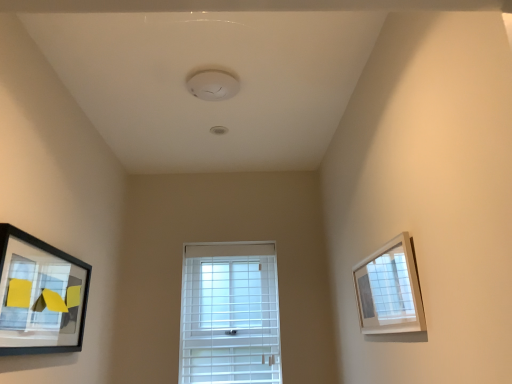
Measure the distance between white matte picture frame at upper right, which ranks as the 2th picture frame in left-to-right order, and camera.

1.04 meters.

Locate an element on the screen. matte black picture frame at left, which is counted as the 2th picture frame, starting from the right is located at coordinates (40, 296).

Locate an element on the screen. white matte picture frame at upper right, acting as the 1th picture frame starting from the right is located at coordinates (389, 290).

Can you confirm if white plastic window at center is wider than matte black picture frame at left, positioned as the 1th picture frame in left-to-right order?

Yes, white plastic window at center is wider than matte black picture frame at left, positioned as the 1th picture frame in left-to-right order.

Where is `window behind the matte black picture frame at left, which is counted as the 2th picture frame, starting from the right`? The height and width of the screenshot is (384, 512). window behind the matte black picture frame at left, which is counted as the 2th picture frame, starting from the right is located at coordinates (230, 314).

Considering the relative positions of white plastic window at center and matte black picture frame at left, which is counted as the 2th picture frame, starting from the right, in the image provided, is white plastic window at center to the right of matte black picture frame at left, which is counted as the 2th picture frame, starting from the right, from the viewer's perspective?

Yes, white plastic window at center is to the right of matte black picture frame at left, which is counted as the 2th picture frame, starting from the right.

From the image's perspective, is white plastic window at center on matte black picture frame at left, positioned as the 1th picture frame in left-to-right order?

Incorrect, from the image's perspective, white plastic window at center is lower than matte black picture frame at left, positioned as the 1th picture frame in left-to-right order.

Is white plastic window at center touching white matte picture frame at upper right, which ranks as the 2th picture frame in left-to-right order?

white plastic window at center is not next to white matte picture frame at upper right, which ranks as the 2th picture frame in left-to-right order, and they're not touching.

Can you confirm if white plastic window at center is positioned to the right of white matte picture frame at upper right, which ranks as the 2th picture frame in left-to-right order?

Incorrect, white plastic window at center is not on the right side of white matte picture frame at upper right, which ranks as the 2th picture frame in left-to-right order.

Looking at this image, from a real-world perspective, which is physically above, white plastic window at center or white matte picture frame at upper right, acting as the 1th picture frame starting from the right?

white matte picture frame at upper right, acting as the 1th picture frame starting from the right, is physically above.

Based on the photo, would you say white plastic window at center is outside white matte picture frame at upper right, acting as the 1th picture frame starting from the right?

white plastic window at center lies outside white matte picture frame at upper right, acting as the 1th picture frame starting from the right,'s area.

Which of these two, white matte picture frame at upper right, acting as the 1th picture frame starting from the right, or white plastic window at center, is smaller?

Smaller between the two is white matte picture frame at upper right, acting as the 1th picture frame starting from the right.

Between point (409, 254) and point (258, 340), which one is positioned behind?

The point (258, 340) is behind.

Which object is wider, white matte picture frame at upper right, acting as the 1th picture frame starting from the right, or white plastic window at center?

white plastic window at center is wider.

From the image's perspective, is white matte picture frame at upper right, which ranks as the 2th picture frame in left-to-right order, above or below white plastic window at center?

Clearly, from the image's perspective, white matte picture frame at upper right, which ranks as the 2th picture frame in left-to-right order, is above white plastic window at center.

Is white matte picture frame at upper right, acting as the 1th picture frame starting from the right, not near matte black picture frame at left, which is counted as the 2th picture frame, starting from the right?

Yes, white matte picture frame at upper right, acting as the 1th picture frame starting from the right, and matte black picture frame at left, which is counted as the 2th picture frame, starting from the right, are located far from each other.

From the image's perspective, is white matte picture frame at upper right, acting as the 1th picture frame starting from the right, under matte black picture frame at left, positioned as the 1th picture frame in left-to-right order?

No, from the image's perspective, white matte picture frame at upper right, acting as the 1th picture frame starting from the right, is not beneath matte black picture frame at left, positioned as the 1th picture frame in left-to-right order.

From a real-world perspective, is white matte picture frame at upper right, which ranks as the 2th picture frame in left-to-right order, located higher than matte black picture frame at left, which is counted as the 2th picture frame, starting from the right?

Incorrect, from a real-world perspective, white matte picture frame at upper right, which ranks as the 2th picture frame in left-to-right order, is lower than matte black picture frame at left, which is counted as the 2th picture frame, starting from the right.

Based on the photo, considering the relative sizes of white matte picture frame at upper right, acting as the 1th picture frame starting from the right, and matte black picture frame at left, positioned as the 1th picture frame in left-to-right order, in the image provided, is white matte picture frame at upper right, acting as the 1th picture frame starting from the right, smaller than matte black picture frame at left, positioned as the 1th picture frame in left-to-right order,?

Correct, white matte picture frame at upper right, acting as the 1th picture frame starting from the right, occupies less space than matte black picture frame at left, positioned as the 1th picture frame in left-to-right order.

Is matte black picture frame at left, which is counted as the 2th picture frame, starting from the right, at the right side of white matte picture frame at upper right, acting as the 1th picture frame starting from the right?

No, matte black picture frame at left, which is counted as the 2th picture frame, starting from the right, is not to the right of white matte picture frame at upper right, acting as the 1th picture frame starting from the right.

Who is more distant, matte black picture frame at left, positioned as the 1th picture frame in left-to-right order, or white matte picture frame at upper right, acting as the 1th picture frame starting from the right?

white matte picture frame at upper right, acting as the 1th picture frame starting from the right, is behind.

At what (x,y) coordinates should I click in order to perform the action: click on picture frame to the right of matte black picture frame at left, positioned as the 1th picture frame in left-to-right order. Please return your answer as a coordinate pair (x, y). The width and height of the screenshot is (512, 384). Looking at the image, I should click on (389, 290).

Is matte black picture frame at left, positioned as the 1th picture frame in left-to-right order, completely or partially outside of white matte picture frame at upper right, which ranks as the 2th picture frame in left-to-right order?

Indeed, matte black picture frame at left, positioned as the 1th picture frame in left-to-right order, is completely outside white matte picture frame at upper right, which ranks as the 2th picture frame in left-to-right order.

Between matte black picture frame at left, which is counted as the 2th picture frame, starting from the right, and white plastic window at center, which one has larger size?

With larger size is white plastic window at center.

Measure the distance from matte black picture frame at left, positioned as the 1th picture frame in left-to-right order, to white plastic window at center.

They are 1.03 meters apart.

From the image's perspective, is matte black picture frame at left, which is counted as the 2th picture frame, starting from the right, over white plastic window at center?

Correct, matte black picture frame at left, which is counted as the 2th picture frame, starting from the right, appears higher than white plastic window at center in the image.

Is matte black picture frame at left, which is counted as the 2th picture frame, starting from the right, in front of or behind white plastic window at center in the image?

matte black picture frame at left, which is counted as the 2th picture frame, starting from the right, is in front of white plastic window at center.

The image size is (512, 384). Find the location of `picture frame on the left side of white plastic window at center`. picture frame on the left side of white plastic window at center is located at coordinates (40, 296).

In the image, there is a white matte picture frame at upper right, acting as the 1th picture frame starting from the right. Identify the location of window below it (from the image's perspective). Image resolution: width=512 pixels, height=384 pixels. [230, 314].

Looking at the image, which one is located closer to matte black picture frame at left, which is counted as the 2th picture frame, starting from the right, white matte picture frame at upper right, acting as the 1th picture frame starting from the right, or white plastic window at center?

white plastic window at center lies closer to matte black picture frame at left, which is counted as the 2th picture frame, starting from the right, than the other object.

Based on their spatial positions, is white plastic window at center or white matte picture frame at upper right, which ranks as the 2th picture frame in left-to-right order, closer to matte black picture frame at left, positioned as the 1th picture frame in left-to-right order?

white plastic window at center is positioned closer to the anchor matte black picture frame at left, positioned as the 1th picture frame in left-to-right order.

Which object lies further to the anchor point white plastic window at center, matte black picture frame at left, positioned as the 1th picture frame in left-to-right order, or white matte picture frame at upper right, acting as the 1th picture frame starting from the right?

white matte picture frame at upper right, acting as the 1th picture frame starting from the right, is further to white plastic window at center.

Looking at the image, which one is located further to white plastic window at center, white matte picture frame at upper right, which ranks as the 2th picture frame in left-to-right order, or matte black picture frame at left, which is counted as the 2th picture frame, starting from the right?

Based on the image, white matte picture frame at upper right, which ranks as the 2th picture frame in left-to-right order, appears to be further to white plastic window at center.

From the picture: When comparing their distances from white matte picture frame at upper right, which ranks as the 2th picture frame in left-to-right order, does matte black picture frame at left, which is counted as the 2th picture frame, starting from the right, or white plastic window at center seem further?

white plastic window at center lies further to white matte picture frame at upper right, which ranks as the 2th picture frame in left-to-right order, than the other object.

Based on their spatial positions, is white plastic window at center or matte black picture frame at left, which is counted as the 2th picture frame, starting from the right, closer to white matte picture frame at upper right, which ranks as the 2th picture frame in left-to-right order?

The object closer to white matte picture frame at upper right, which ranks as the 2th picture frame in left-to-right order, is matte black picture frame at left, which is counted as the 2th picture frame, starting from the right.

Find the location of a particular element. Image resolution: width=512 pixels, height=384 pixels. picture frame located between matte black picture frame at left, which is counted as the 2th picture frame, starting from the right, and white plastic window at center in the depth direction is located at coordinates (389, 290).